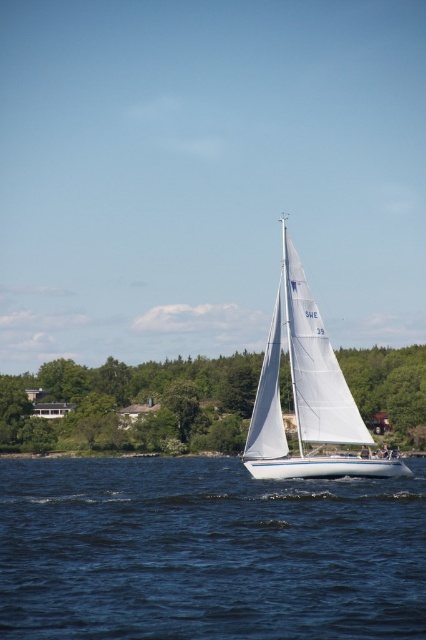
Question: Can you confirm if blue water at center is smaller than white sailboat at center?

Choices:
 (A) no
 (B) yes

Answer: (A)

Question: Which of these objects is positioned closest to the blue water at center?

Choices:
 (A) green leafy tree at center
 (B) white sailboat at center

Answer: (B)

Question: Among these objects, which one is farthest from the camera?

Choices:
 (A) green leafy tree at center
 (B) white sailboat at center

Answer: (A)

Question: Which point is farther to the camera?

Choices:
 (A) white sailboat at center
 (B) green leafy tree at center
 (C) blue water at center

Answer: (B)

Question: Can you confirm if blue water at center is thinner than white sailboat at center?

Choices:
 (A) yes
 (B) no

Answer: (B)

Question: Is blue water at center positioned in front of green leafy tree at center?

Choices:
 (A) yes
 (B) no

Answer: (A)